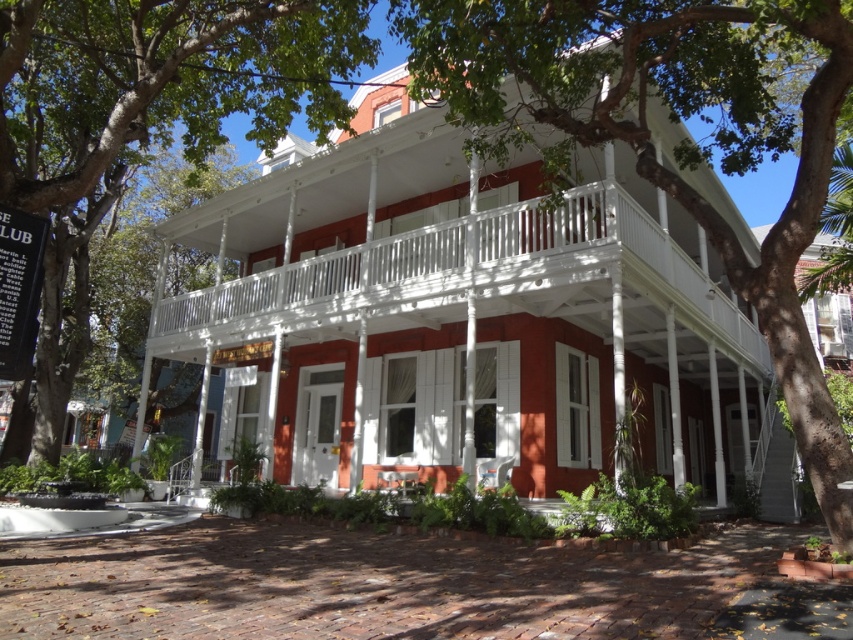
Measure the distance between point [206,113] and camera.

The distance of point [206,113] from camera is 11.30 meters.

This screenshot has width=853, height=640. Identify the location of green leafy tree at upper left. (160, 81).

Based on the photo, does green leafy tree at upper center have a lesser height compared to green leafy tree at upper left?

Indeed, green leafy tree at upper center has a lesser height compared to green leafy tree at upper left.

Where is `green leafy tree at upper center`? This screenshot has height=640, width=853. green leafy tree at upper center is located at coordinates (672, 120).

This screenshot has height=640, width=853. I want to click on green leafy tree at upper center, so pyautogui.click(x=672, y=120).

Does point (618, 109) come closer to viewer compared to point (659, 280)?

Yes, point (618, 109) is in front of point (659, 280).

Which is more to the left, green leafy tree at upper center or white wooden balcony at center?

From the viewer's perspective, white wooden balcony at center appears more on the left side.

Where is `green leafy tree at upper center`? green leafy tree at upper center is located at coordinates (672, 120).